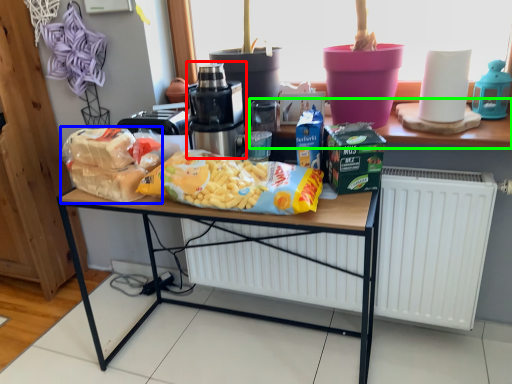
Question: Which object is the farthest from home appliance (highlighted by a red box)? Choose among these: waste (highlighted by a blue box) or window sill (highlighted by a green box).

Choices:
 (A) waste
 (B) window sill

Answer: (B)